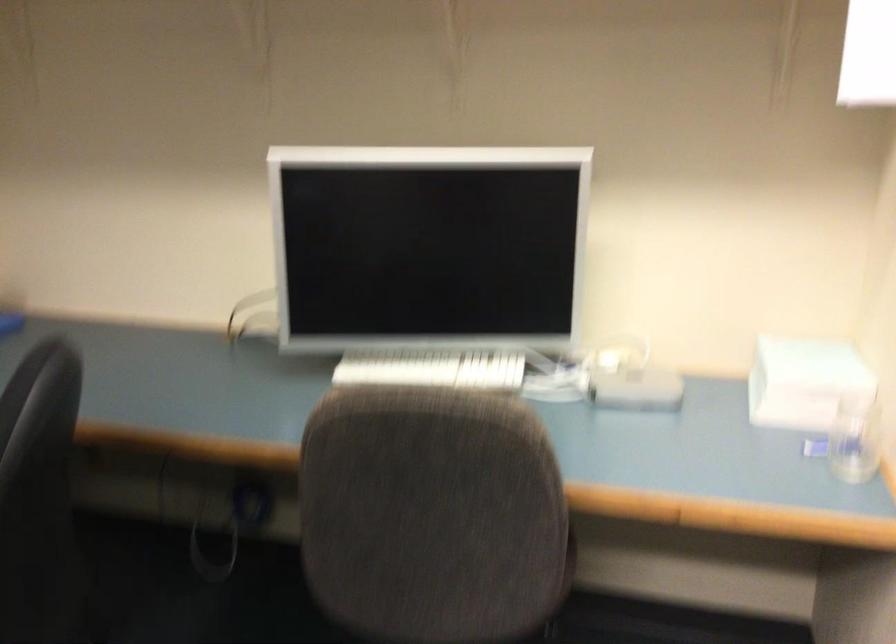
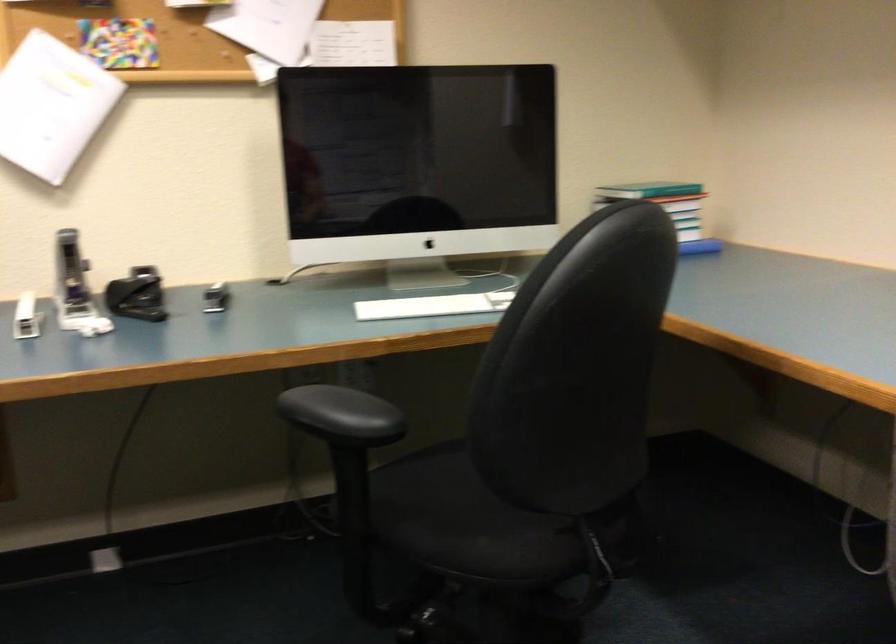
Question: The camera is either moving clockwise (left) or counter-clockwise (right) around the object. The first image is from the beginning of the video and the second image is from the end. Is the camera moving left or right when shooting the video?

Choices:
 (A) Left
 (B) Right

Answer: (B)